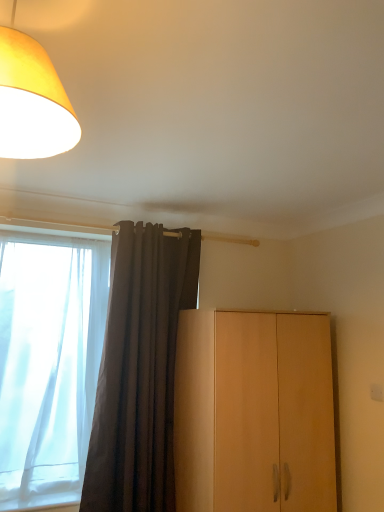
Measure the distance between point [34,246] and camera.

Point [34,246] is 2.57 meters away from camera.

Describe the element at coordinates (140, 370) in the screenshot. I see `dark gray fabric curtain at center` at that location.

Find the location of a particular element. Image resolution: width=384 pixels, height=512 pixels. white sheer curtain at left is located at coordinates (48, 362).

You are a GUI agent. You are given a task and a screenshot of the screen. Output one action in this format:
    pyautogui.click(x=<x>, y=<y>)
    Task: Click on the cabinetry on the right side of dark gray fabric curtain at center
    
    Given the screenshot: What is the action you would take?
    pyautogui.click(x=254, y=412)

Is light wood cabinet at right located outside dark gray fabric curtain at center?

light wood cabinet at right lies outside dark gray fabric curtain at center's area.

Does light wood cabinet at right have a smaller size compared to dark gray fabric curtain at center?

No, light wood cabinet at right is not smaller than dark gray fabric curtain at center.

Which object is positioned more to the right, light wood cabinet at right or dark gray fabric curtain at center?

light wood cabinet at right.

Is light wood cabinet at right positioned in front of yellow fabric lampshade at upper left?

No, it is behind yellow fabric lampshade at upper left.

From the image's perspective, is light wood cabinet at right on top of yellow fabric lampshade at upper left?

Incorrect, from the image's perspective, light wood cabinet at right is lower than yellow fabric lampshade at upper left.

Considering the points (175, 461) and (26, 59), which point is in front, point (175, 461) or point (26, 59)?

The point (26, 59) is closer to the camera.

How distant is light wood cabinet at right from yellow fabric lampshade at upper left?

They are 1.75 meters apart.

Is yellow fabric lampshade at upper left next to white sheer curtain at left?

No.

Considering the relative positions of yellow fabric lampshade at upper left and white sheer curtain at left in the image provided, is yellow fabric lampshade at upper left to the right of white sheer curtain at left from the viewer's perspective?

Indeed, yellow fabric lampshade at upper left is positioned on the right side of white sheer curtain at left.

Based on the photo, from a real-world perspective, which is physically above, yellow fabric lampshade at upper left or white sheer curtain at left?

yellow fabric lampshade at upper left is physically above.

From the image's perspective, is yellow fabric lampshade at upper left on top of white sheer curtain at left?

Correct, yellow fabric lampshade at upper left appears higher than white sheer curtain at left in the image.

Are dark gray fabric curtain at center and light wood cabinet at right located far from each other?

That's not correct — dark gray fabric curtain at center is a little close to light wood cabinet at right.

Is dark gray fabric curtain at center turned away from light wood cabinet at right?

No, dark gray fabric curtain at center's orientation is not away from light wood cabinet at right.

Based on the photo, which is behind, dark gray fabric curtain at center or light wood cabinet at right?

dark gray fabric curtain at center is further away from the camera.

Considering the points (108, 391) and (176, 407), which point is in front, point (108, 391) or point (176, 407)?

The point (108, 391) is closer to the camera.

Consider the image. Which of these two, yellow fabric lampshade at upper left or light wood cabinet at right, is smaller?

Smaller between the two is yellow fabric lampshade at upper left.

Is the surface of yellow fabric lampshade at upper left in direct contact with light wood cabinet at right?

No, yellow fabric lampshade at upper left is not next to light wood cabinet at right.

Looking at this image, from the image's perspective, does yellow fabric lampshade at upper left appear higher than light wood cabinet at right?

Indeed, from the image's perspective, yellow fabric lampshade at upper left is shown above light wood cabinet at right.

From the picture: Would you say dark gray fabric curtain at center is a long distance from yellow fabric lampshade at upper left?

Answer: Yes, dark gray fabric curtain at center and yellow fabric lampshade at upper left are quite far apart.

Can you confirm if dark gray fabric curtain at center is thinner than yellow fabric lampshade at upper left?

Yes, dark gray fabric curtain at center is thinner than yellow fabric lampshade at upper left.

From a real-world perspective, is dark gray fabric curtain at center positioned above or below yellow fabric lampshade at upper left?

dark gray fabric curtain at center is below yellow fabric lampshade at upper left.

Is dark gray fabric curtain at center not inside yellow fabric lampshade at upper left?

Yes, dark gray fabric curtain at center is outside of yellow fabric lampshade at upper left.

Between white sheer curtain at left and dark gray fabric curtain at center, which one appears on the left side from the viewer's perspective?

From the viewer's perspective, white sheer curtain at left appears more on the left side.

From a real-world perspective, is white sheer curtain at left physically located above or below dark gray fabric curtain at center?

white sheer curtain at left is above dark gray fabric curtain at center.

Find the location of `cabinetry that is under the dark gray fabric curtain at center (from a real-world perspective)`. cabinetry that is under the dark gray fabric curtain at center (from a real-world perspective) is located at coordinates click(254, 412).

Find the location of a particular element. The height and width of the screenshot is (512, 384). cabinetry that is below the yellow fabric lampshade at upper left (from the image's perspective) is located at coordinates 254,412.

Estimate the real-world distances between objects in this image. Which object is further from dark gray fabric curtain at center, light wood cabinet at right or yellow fabric lampshade at upper left?

Among the two, yellow fabric lampshade at upper left is located further to dark gray fabric curtain at center.

Consider the image. Based on their spatial positions, is dark gray fabric curtain at center or white sheer curtain at left closer to light wood cabinet at right?

dark gray fabric curtain at center is closer to light wood cabinet at right.

Which object lies nearer to the anchor point light wood cabinet at right, yellow fabric lampshade at upper left or dark gray fabric curtain at center?

dark gray fabric curtain at center.

From the image, which object appears to be nearer to white sheer curtain at left, light wood cabinet at right or dark gray fabric curtain at center?

Based on the image, dark gray fabric curtain at center appears to be nearer to white sheer curtain at left.

From the image, which object appears to be farther from white sheer curtain at left, dark gray fabric curtain at center or yellow fabric lampshade at upper left?

yellow fabric lampshade at upper left is positioned further to the anchor white sheer curtain at left.

Considering their positions, is yellow fabric lampshade at upper left positioned closer to dark gray fabric curtain at center than white sheer curtain at left?

The object closer to dark gray fabric curtain at center is white sheer curtain at left.

From the image, which object appears to be farther from light wood cabinet at right, dark gray fabric curtain at center or yellow fabric lampshade at upper left?

yellow fabric lampshade at upper left.

Considering their positions, is dark gray fabric curtain at center positioned closer to white sheer curtain at left than light wood cabinet at right?

Among the two, dark gray fabric curtain at center is located nearer to white sheer curtain at left.

Where is `curtain located between yellow fabric lampshade at upper left and white sheer curtain at left in the depth direction`? curtain located between yellow fabric lampshade at upper left and white sheer curtain at left in the depth direction is located at coordinates (x=140, y=370).

Where is `cabinetry positioned between yellow fabric lampshade at upper left and white sheer curtain at left from near to far`? The height and width of the screenshot is (512, 384). cabinetry positioned between yellow fabric lampshade at upper left and white sheer curtain at left from near to far is located at coordinates point(254,412).

Find the location of a particular element. The width and height of the screenshot is (384, 512). cabinetry located between yellow fabric lampshade at upper left and dark gray fabric curtain at center in the depth direction is located at coordinates (254, 412).

At what (x,y) coordinates should I click in order to perform the action: click on curtain between white sheer curtain at left and light wood cabinet at right. Please return your answer as a coordinate pair (x, y). Looking at the image, I should click on (140, 370).